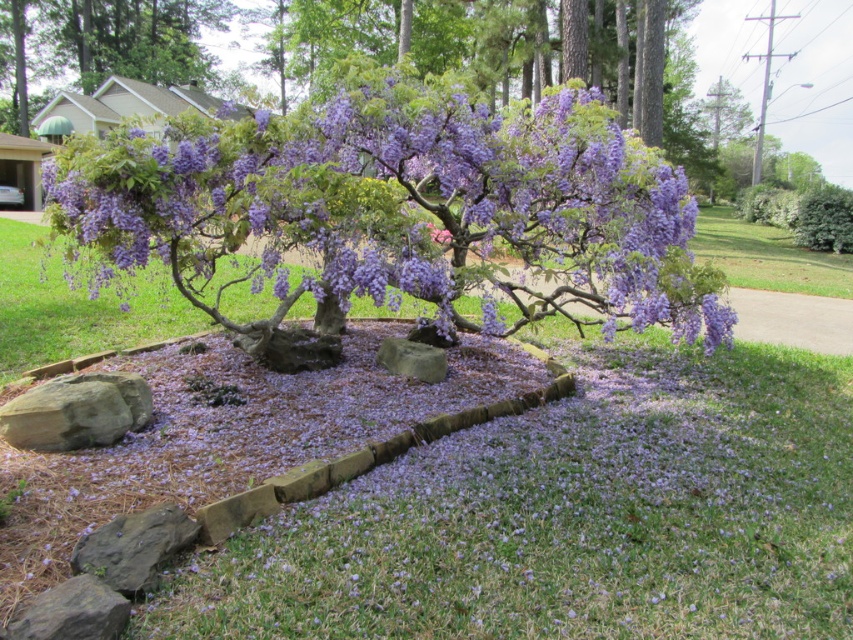
You are a gardener planning to place a small potted plant between the purple gravel at center and the gray rough rock at lower left. Which object should you position the potted plant closer to if you want it to be at a lower elevation?

The gray rough rock at lower left is shorter than the purple gravel at center, so positioning the potted plant closer to the gray rough rock at lower left would place it at a lower elevation.

You are a gardener who needs to place a small potted plant between the purple gravel at center and the brown rough rock at lower left. Which object should you place the potted plant closer to if you want it to be near the larger object?

You should place the potted plant closer to the purple gravel at center because it is larger in size than the brown rough rock at lower left.